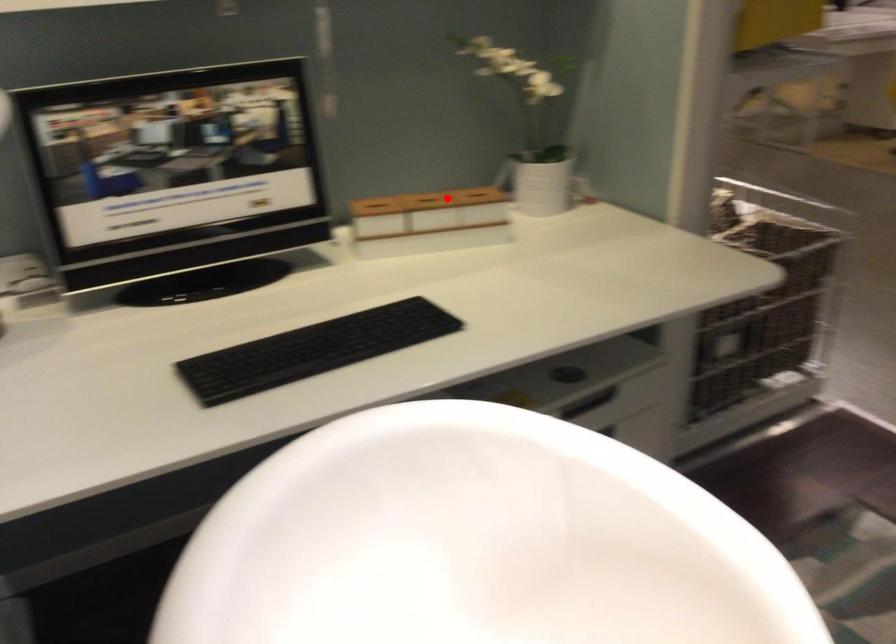
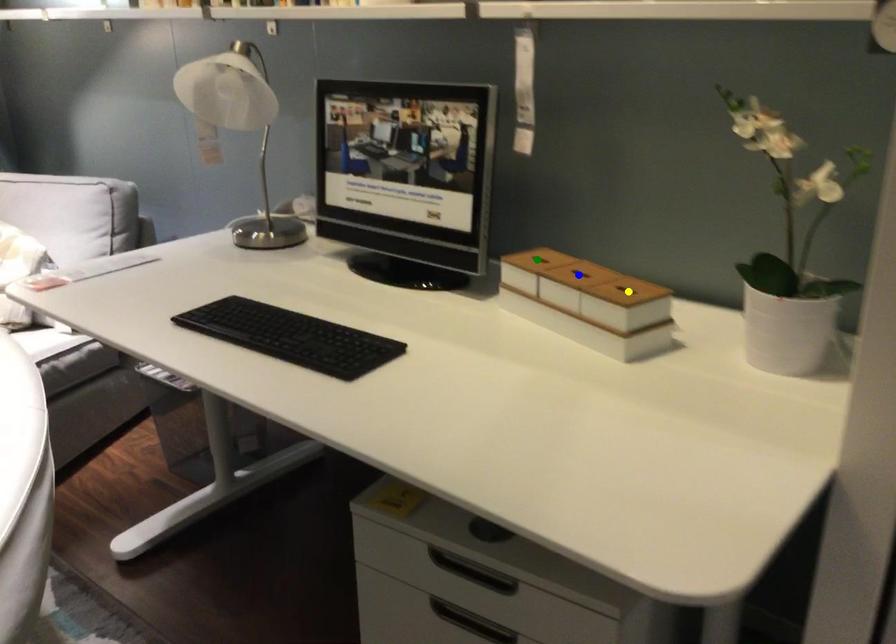
Question: I am providing you with two images of the same scene from different viewpoints. A red point is marked on the first image. You are given multiple points on the second image. Which mark in image 2 goes with the point in image 1?

Choices:
 (A) green point
 (B) yellow point
 (C) blue point

Answer: (C)